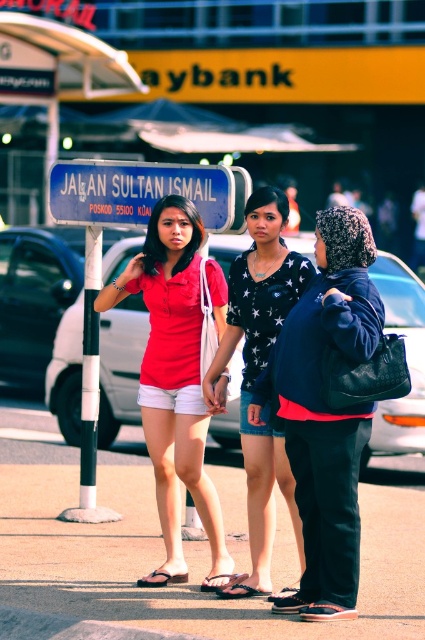
Does denim shorts at center have a smaller size compared to black glossy pole at center?

No.

Locate an element on the screen. The height and width of the screenshot is (640, 425). denim shorts at center is located at coordinates (258, 372).

At what (x,y) coordinates should I click in order to perform the action: click on denim shorts at center. Please return your answer as a coordinate pair (x, y). This screenshot has height=640, width=425. Looking at the image, I should click on (258, 372).

Is black leather jacket at center thinner than black glossy pole at center?

Incorrect, black leather jacket at center's width is not less than black glossy pole at center's.

Is point (353, 616) positioned after point (85, 282)?

No, (353, 616) is closer to viewer.

In order to click on black leather jacket at center in this screenshot , I will do `click(325, 412)`.

Does black leather jacket at center have a greater width compared to matte red shirt at center?

No.

Measure the distance between black leather jacket at center and camera.

The distance of black leather jacket at center from camera is 23.99 feet.

Between point (339, 609) and point (172, 492), which one is positioned in front?

Point (339, 609) is in front.

The width and height of the screenshot is (425, 640). I want to click on black leather jacket at center, so click(325, 412).